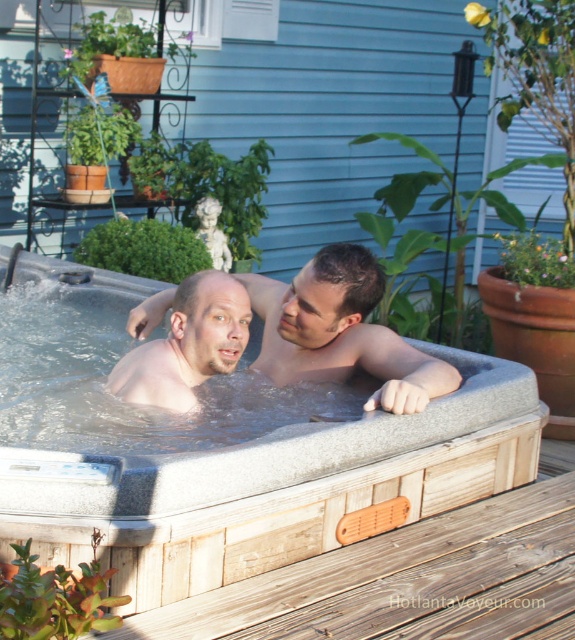
You are standing at the point marked by the coordinate point (411, 579) in the image. Looking towards the hot tub, which direction should you turn to face the wooden deck at lower right?

The point (411, 579) is already at the wooden deck at lower right, so you are already facing it.

You are a photographer positioned at point (340, 332) in the image. You want to capture a closeup shot of the smooth skin man at center. Is the point you are at the correct location to do so?

Yes, the point (340, 332) is where the smooth skin man at center is located, so you are at the correct location to capture the closeup shot.